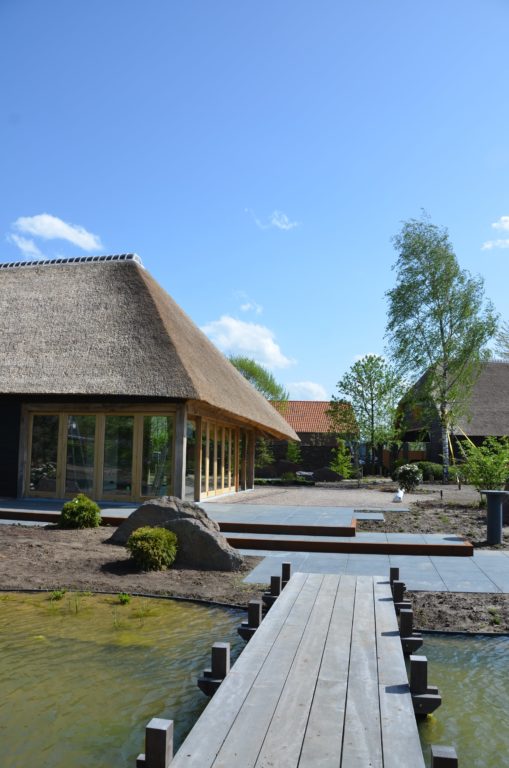
The height and width of the screenshot is (768, 509). I want to click on tiles, so click(316, 561), click(354, 547), click(308, 515).